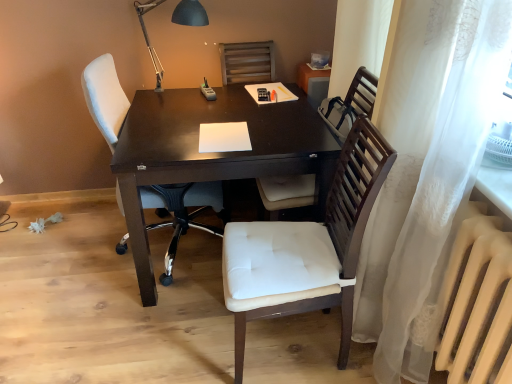
Question: Is white paper at center situated inside black metal table lamp at upper center or outside?

Choices:
 (A) inside
 (B) outside

Answer: (B)

Question: Would you say white paper at center is to the left or to the right of black metal table lamp at upper center in the picture?

Choices:
 (A) left
 (B) right

Answer: (B)

Question: Which object is positioned closest to the white fabric chair at center, which is the second chair in left-to-right order?

Choices:
 (A) white paper at center
 (B) white matte radiator at lower right
 (C) white fabric chair at left, which is the third chair from right to left
 (D) white sheer curtain at right
 (E) wooden chair at center, the 1th chair from the right

Answer: (D)

Question: Which object is the farthest from the dark wood desk at center?

Choices:
 (A) white fabric chair at center, which is the second chair in left-to-right order
 (B) white matte radiator at lower right
 (C) white fabric chair at left, which is counted as the first chair, starting from the left
 (D) white sheer curtain at right
 (E) white paper at center

Answer: (B)